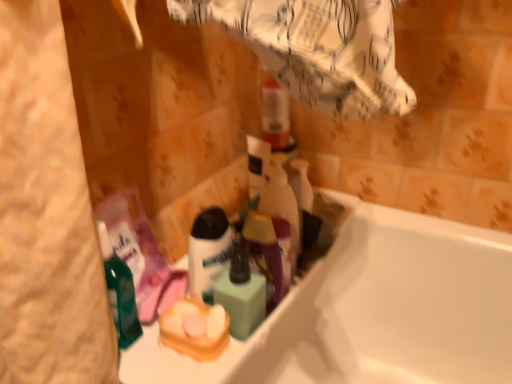
The width and height of the screenshot is (512, 384). I want to click on white matte shaving cream at center, so (208, 252).

Locate an element on the screen. The height and width of the screenshot is (384, 512). white matte shaving cream at center is located at coordinates (208, 252).

Which is in front, white matte shaving cream at center or yellow sponge at center?

yellow sponge at center.

From a real-world perspective, which is physically below, white matte shaving cream at center or yellow sponge at center?

From a 3D spatial view, yellow sponge at center is below.

Does white matte shaving cream at center have a lesser width compared to yellow sponge at center?

Indeed, white matte shaving cream at center has a lesser width compared to yellow sponge at center.

Is white matte shaving cream at center at the back of white glossy bathtub at lower right?

white glossy bathtub at lower right does not have its back to white matte shaving cream at center.

Consider the image. From the image's perspective, which is above, white glossy bathtub at lower right or white matte shaving cream at center?

From the image's view, white matte shaving cream at center is above.

Is white glossy bathtub at lower right with white matte shaving cream at center?

No, white glossy bathtub at lower right is not with white matte shaving cream at center.

Which is nearer, (x=505, y=288) or (x=205, y=264)?

The point (x=205, y=264) is in front.

Considering the positions of objects translucent purple spray bottle at center and green matte mouthwash at center in the image provided, who is behind, translucent purple spray bottle at center or green matte mouthwash at center?

translucent purple spray bottle at center is more distant.

Is translucent purple spray bottle at center inside the boundaries of green matte mouthwash at center, or outside?

translucent purple spray bottle at center is spatially situated outside green matte mouthwash at center.

Consider the image. Which of these two, translucent purple spray bottle at center or green matte mouthwash at center, stands shorter?

With less height is green matte mouthwash at center.

Looking at their sizes, would you say translucent purple spray bottle at center is wider or thinner than green matte mouthwash at center?

Considering their sizes, translucent purple spray bottle at center looks broader than green matte mouthwash at center.

Which point is more distant from viewer, (x=412, y=373) or (x=253, y=320)?

Positioned behind is point (x=412, y=373).

Considering the sizes of objects white glossy bathtub at lower right and green matte mouthwash at center in the image provided, who is smaller, white glossy bathtub at lower right or green matte mouthwash at center?

green matte mouthwash at center.

From the image's perspective, which one is positioned higher, white glossy bathtub at lower right or green matte mouthwash at center?

green matte mouthwash at center appears higher in the image.

Would you say yellow sponge at center is outside white glossy bathtub at lower right?

Yes, yellow sponge at center is located beyond the bounds of white glossy bathtub at lower right.

From the image's perspective, is yellow sponge at center over white glossy bathtub at lower right?

Indeed, from the image's perspective, yellow sponge at center is shown above white glossy bathtub at lower right.

Is yellow sponge at center looking in the opposite direction of white glossy bathtub at lower right?

No, yellow sponge at center is not facing the opposite direction of white glossy bathtub at lower right.

Looking at the image, does translucent purple spray bottle at center seem bigger or smaller compared to yellow sponge at center?

Considering their sizes, translucent purple spray bottle at center takes up more space than yellow sponge at center.

Is translucent purple spray bottle at center situated inside yellow sponge at center or outside?

translucent purple spray bottle at center is not inside yellow sponge at center, it's outside.

Is translucent purple spray bottle at center facing towards yellow sponge at center?

No.

In terms of height, does translucent purple spray bottle at center look taller or shorter compared to yellow sponge at center?

translucent purple spray bottle at center is taller than yellow sponge at center.

You are a GUI agent. You are given a task and a screenshot of the screen. Output one action in this format:
    pyautogui.click(x=<x>, y=<y>)
    Task: Click on the product in front of the green matte mouthwash at center
    This screenshot has width=512, height=384.
    Given the screenshot: What is the action you would take?
    pyautogui.click(x=195, y=329)

Can you confirm if yellow sponge at center is taller than green matte mouthwash at center?

In fact, yellow sponge at center may be shorter than green matte mouthwash at center.

Which object is more forward, yellow sponge at center or green matte mouthwash at center?

yellow sponge at center is in front.

What's the angular difference between yellow sponge at center and green matte mouthwash at center's facing directions?

0.00497 degrees separate the facing orientations of yellow sponge at center and green matte mouthwash at center.

The height and width of the screenshot is (384, 512). I want to click on product located on the left of white matte shaving cream at center, so click(195, 329).

You are a GUI agent. You are given a task and a screenshot of the screen. Output one action in this format:
    pyautogui.click(x=<x>, y=<y>)
    Task: Click on the bathtub directly beneath the white matte shaving cream at center (from a real-world perspective)
    The width and height of the screenshot is (512, 384).
    Given the screenshot: What is the action you would take?
    pyautogui.click(x=371, y=312)

Based on their spatial positions, is white glossy bathtub at lower right or yellow sponge at center further from green matte mouthwash at center?

white glossy bathtub at lower right lies further to green matte mouthwash at center than the other object.

Looking at the image, which one is located further to translucent purple spray bottle at center, white glossy bathtub at lower right or green matte mouthwash at center?

white glossy bathtub at lower right lies further to translucent purple spray bottle at center than the other object.

Considering their positions, is white glossy bathtub at lower right positioned closer to translucent purple spray bottle at center than yellow sponge at center?

yellow sponge at center is closer to translucent purple spray bottle at center.

From the image, which object appears to be farther from white matte shaving cream at center, white glossy bathtub at lower right or translucent purple spray bottle at center?

Based on the image, white glossy bathtub at lower right appears to be further to white matte shaving cream at center.

Considering their positions, is white glossy bathtub at lower right positioned closer to yellow sponge at center than green matte mouthwash at center?

Based on the image, green matte mouthwash at center appears to be nearer to yellow sponge at center.

Based on their spatial positions, is white glossy bathtub at lower right or green matte mouthwash at center closer to white matte shaving cream at center?

green matte mouthwash at center lies closer to white matte shaving cream at center than the other object.

Based on their spatial positions, is green matte mouthwash at center or translucent purple spray bottle at center closer to white matte shaving cream at center?

green matte mouthwash at center is positioned closer to the anchor white matte shaving cream at center.

Looking at the image, which one is located closer to white matte shaving cream at center, green matte mouthwash at center or yellow sponge at center?

green matte mouthwash at center is closer to white matte shaving cream at center.

Where is `mouthwash between translucent purple spray bottle at center and white glossy bathtub at lower right from top to bottom`? This screenshot has height=384, width=512. mouthwash between translucent purple spray bottle at center and white glossy bathtub at lower right from top to bottom is located at coordinates (241, 295).

Where is `shaving cream between yellow sponge at center and translucent purple spray bottle at center`? This screenshot has height=384, width=512. shaving cream between yellow sponge at center and translucent purple spray bottle at center is located at coordinates (208, 252).

You are a GUI agent. You are given a task and a screenshot of the screen. Output one action in this format:
    pyautogui.click(x=<x>, y=<y>)
    Task: Click on the product between white glossy bathtub at lower right and green matte mouthwash at center from front to back
    
    Given the screenshot: What is the action you would take?
    pyautogui.click(x=195, y=329)

Identify the location of mouthwash between translucent purple spray bottle at center and yellow sponge at center in the vertical direction. This screenshot has height=384, width=512. (241, 295).